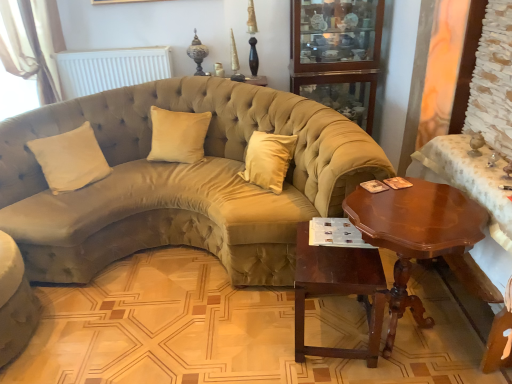
Locate an element on the screen. beige velvet pillow at left, the 1th pillow in the left-to-right sequence is located at coordinates (70, 159).

What do you see at coordinates (70, 159) in the screenshot? I see `beige velvet pillow at left, which is the second pillow from right to left` at bounding box center [70, 159].

The width and height of the screenshot is (512, 384). Identify the location of white matte radiator at upper center. (110, 69).

Image resolution: width=512 pixels, height=384 pixels. I want to click on glass cabinet at upper center, so click(337, 46).

Locate an element on the screen. suede beige couch at center, which ranks as the 2th studio couch in left-to-right order is located at coordinates (180, 181).

Is mahogany wood table at lower center completely or partially inside shiny brown wood coffee table at right?

Yes, mahogany wood table at lower center is a part of shiny brown wood coffee table at right.

Is shiny brown wood coffee table at right far away from mahogany wood table at lower center?

No, shiny brown wood coffee table at right is in close proximity to mahogany wood table at lower center.

In the scene shown: Considering the relative sizes of shiny brown wood coffee table at right and mahogany wood table at lower center in the image provided, is shiny brown wood coffee table at right bigger than mahogany wood table at lower center?

Yes.

Which is behind, shiny brown wood coffee table at right or beige velvet pillow at left, which is the second pillow from right to left?

beige velvet pillow at left, which is the second pillow from right to left, is more distant.

Which of these two, shiny brown wood coffee table at right or beige velvet pillow at left, the 1th pillow in the left-to-right sequence, stands shorter?

With less height is beige velvet pillow at left, the 1th pillow in the left-to-right sequence.

Measure the distance from shiny brown wood coffee table at right to beige velvet pillow at left, which is the second pillow from right to left.

shiny brown wood coffee table at right is 1.78 meters from beige velvet pillow at left, which is the second pillow from right to left.

Is shiny brown wood coffee table at right positioned beyond the bounds of beige velvet pillow at left, which is the second pillow from right to left?

Yes, shiny brown wood coffee table at right is outside of beige velvet pillow at left, which is the second pillow from right to left.

From the image's perspective, which is below, mahogany wood table at lower center or beige velvet pillow at center, the 1th pillow from the right?

From the image's view, mahogany wood table at lower center is below.

Looking at the image, does mahogany wood table at lower center seem bigger or smaller compared to beige velvet pillow at center, acting as the second pillow starting from the left?

Clearly, mahogany wood table at lower center is larger in size than beige velvet pillow at center, acting as the second pillow starting from the left.

Can you see mahogany wood table at lower center touching beige velvet pillow at center, acting as the second pillow starting from the left?

mahogany wood table at lower center and beige velvet pillow at center, acting as the second pillow starting from the left, are not in contact.

From a real-world perspective, is mahogany wood table at lower center physically below beige velvet pillow at center, acting as the second pillow starting from the left?

Yes, from a real-world perspective, mahogany wood table at lower center is below beige velvet pillow at center, acting as the second pillow starting from the left.

From a real-world perspective, between beige fabric curtain at upper left and beige velvet pillow at left, which is the second pillow from right to left, who is vertically higher?

beige fabric curtain at upper left.

Is beige fabric curtain at upper left in front of or behind beige velvet pillow at left, the 1th pillow in the left-to-right sequence, in the image?

beige fabric curtain at upper left is behind beige velvet pillow at left, the 1th pillow in the left-to-right sequence.

Is beige fabric curtain at upper left smaller than beige velvet pillow at left, the 1th pillow in the left-to-right sequence?

Actually, beige fabric curtain at upper left might be larger than beige velvet pillow at left, the 1th pillow in the left-to-right sequence.

Which point is more distant from viewer, (127, 64) or (38, 84)?

Positioned behind is point (38, 84).

Considering the sizes of white matte radiator at upper center and beige fabric curtain at upper left in the image, is white matte radiator at upper center wider or thinner than beige fabric curtain at upper left?

Considering their sizes, white matte radiator at upper center looks slimmer than beige fabric curtain at upper left.

How different are the orientations of white matte radiator at upper center and beige fabric curtain at upper left in degrees?

The facing directions of white matte radiator at upper center and beige fabric curtain at upper left are 0.000168 degrees apart.

Choose the correct answer: Is white matte radiator at upper center inside beige fabric curtain at upper left or outside it?

white matte radiator at upper center is inside beige fabric curtain at upper left.

Is shiny brown wood coffee table at right positioned far away from beige velvet pillow at center, acting as the second pillow starting from the left?

shiny brown wood coffee table at right is positioned a significant distance from beige velvet pillow at center, acting as the second pillow starting from the left.

Considering the sizes of shiny brown wood coffee table at right and beige velvet pillow at center, the 1th pillow from the right, in the image, is shiny brown wood coffee table at right wider or thinner than beige velvet pillow at center, the 1th pillow from the right,?

Considering their sizes, shiny brown wood coffee table at right looks broader than beige velvet pillow at center, the 1th pillow from the right.

Between point (409, 305) and point (173, 116), which one is positioned behind?

Positioned behind is point (173, 116).

Between velvet beige couch at lower left, the second studio couch from the right, and white matte radiator at upper center, which one has smaller size?

With smaller size is white matte radiator at upper center.

Is point (21, 298) closer or farther from the camera than point (83, 53)?

Point (21, 298) appears to be closer to the viewer than point (83, 53).

Where is `radiator on the right side of velvet beige couch at lower left, the second studio couch from the right`? radiator on the right side of velvet beige couch at lower left, the second studio couch from the right is located at coordinates (110, 69).

Does velvet beige couch at lower left, which is the 1th studio couch from left to right, appear on the left side of white matte radiator at upper center?

Yes.

Locate an element on the screen. This screenshot has height=384, width=512. coffee table above the mahogany wood table at lower center (from a real-world perspective) is located at coordinates (415, 234).

Starting from the shiny brown wood coffee table at right, which pillow is the 2nd one to the left? Please provide its 2D coordinates.

[(70, 159)]

Which object lies further to the anchor point glass cabinet at upper center, velvet beige couch at lower left, the second studio couch from the right, or beige velvet pillow at center, acting as the second pillow starting from the left?

Among the two, velvet beige couch at lower left, the second studio couch from the right, is located further to glass cabinet at upper center.

Consider the image. Estimate the real-world distances between objects in this image. Which object is closer to beige velvet pillow at left, which is the second pillow from right to left, velvet beige couch at lower left, the second studio couch from the right, or beige fabric curtain at upper left?

velvet beige couch at lower left, the second studio couch from the right, lies closer to beige velvet pillow at left, which is the second pillow from right to left, than the other object.

When comparing their distances from shiny brown wood coffee table at right, does white matte radiator at upper center or mahogany wood table at lower center seem further?

The object further to shiny brown wood coffee table at right is white matte radiator at upper center.

From the picture: Based on their spatial positions, is velvet beige couch at lower left, which is the 1th studio couch from left to right, or beige velvet pillow at center, the 1th pillow from the right, further from mahogany wood table at lower center?

velvet beige couch at lower left, which is the 1th studio couch from left to right, lies further to mahogany wood table at lower center than the other object.

Consider the image. Based on their spatial positions, is suede beige couch at center, which ranks as the 2th studio couch in left-to-right order, or glass cabinet at upper center closer to beige fabric curtain at upper left?

Among the two, suede beige couch at center, which ranks as the 2th studio couch in left-to-right order, is located nearer to beige fabric curtain at upper left.

Based on their spatial positions, is velvet beige couch at lower left, which is the 1th studio couch from left to right, or shiny brown wood coffee table at right closer to beige fabric curtain at upper left?

velvet beige couch at lower left, which is the 1th studio couch from left to right, is positioned closer to the anchor beige fabric curtain at upper left.

Looking at the image, which one is located closer to suede beige couch at center, which is the first studio couch in right-to-left order, shiny brown wood coffee table at right or velvet beige couch at lower left, the second studio couch from the right?

velvet beige couch at lower left, the second studio couch from the right, is positioned closer to the anchor suede beige couch at center, which is the first studio couch in right-to-left order.

Looking at the image, which one is located closer to beige velvet pillow at left, the 1th pillow in the left-to-right sequence, beige fabric curtain at upper left or shiny brown wood coffee table at right?

Based on the image, beige fabric curtain at upper left appears to be nearer to beige velvet pillow at left, the 1th pillow in the left-to-right sequence.

This screenshot has width=512, height=384. In order to click on radiator between velvet beige couch at lower left, which is the 1th studio couch from left to right, and mahogany wood table at lower center in this screenshot , I will do `click(110, 69)`.

Find the location of a particular element. This screenshot has height=384, width=512. studio couch that lies between glass cabinet at upper center and mahogany wood table at lower center from top to bottom is located at coordinates (180, 181).

Where is `radiator between beige fabric curtain at upper left and shiny brown wood coffee table at right in the horizontal direction`? The width and height of the screenshot is (512, 384). radiator between beige fabric curtain at upper left and shiny brown wood coffee table at right in the horizontal direction is located at coordinates (110, 69).

Image resolution: width=512 pixels, height=384 pixels. What are the coordinates of `studio couch between white matte radiator at upper center and glass cabinet at upper center in the horizontal direction` in the screenshot? It's located at (180, 181).